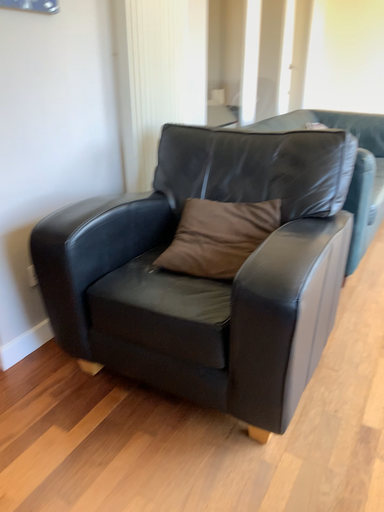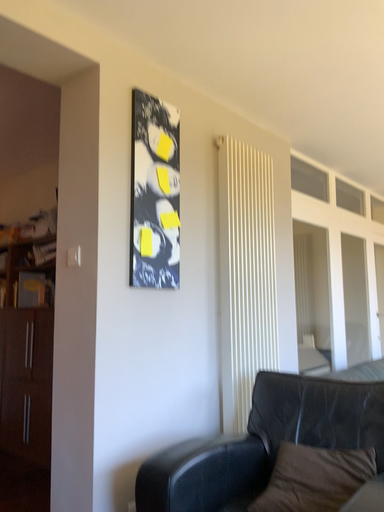
Question: Which way did the camera rotate in the video?

Choices:
 (A) rotated right
 (B) rotated left

Answer: (B)